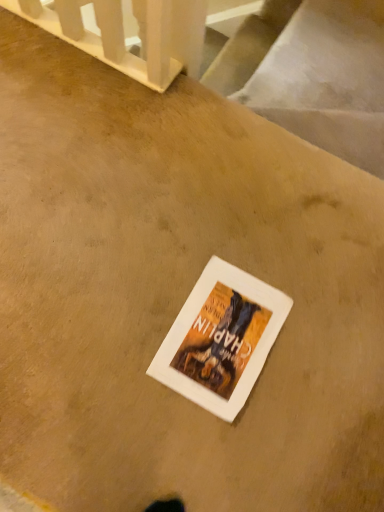
Identify the location of free space above white paper book at center (from a real-world perspective). [x=223, y=330].